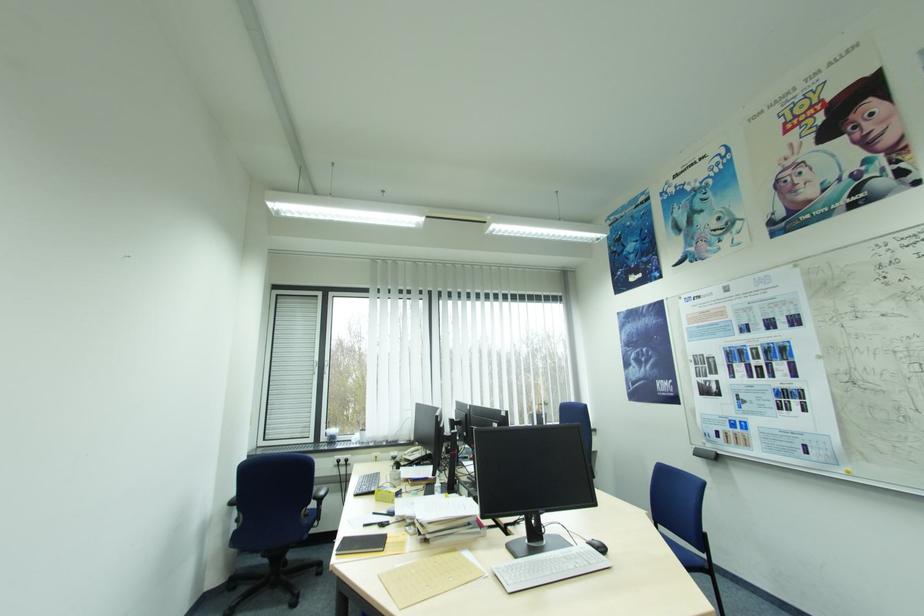
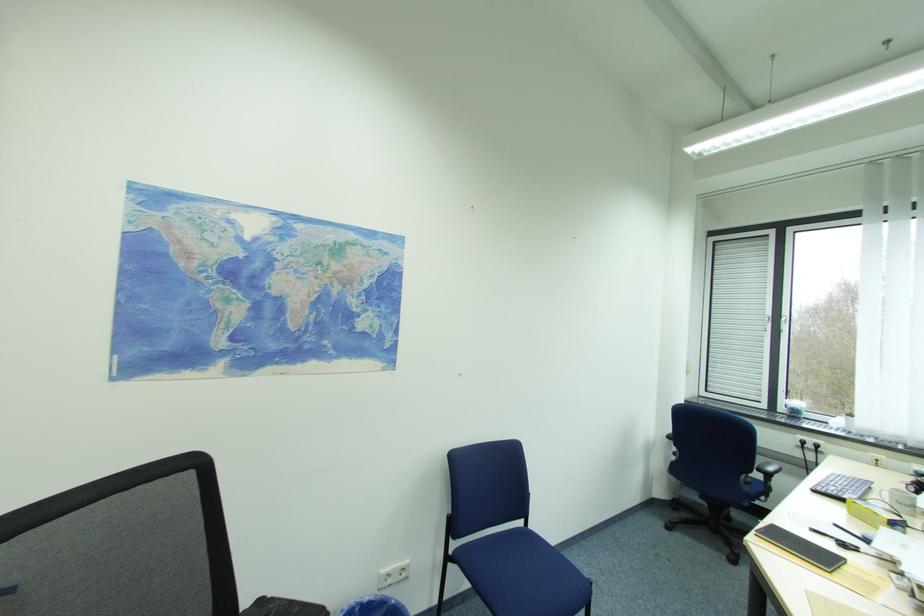
Question: The first image is from the beginning of the video and the second image is from the end. How did the camera likely rotate when shooting the video?

Choices:
 (A) Left
 (B) Right
 (C) Up
 (D) Down

Answer: (A)